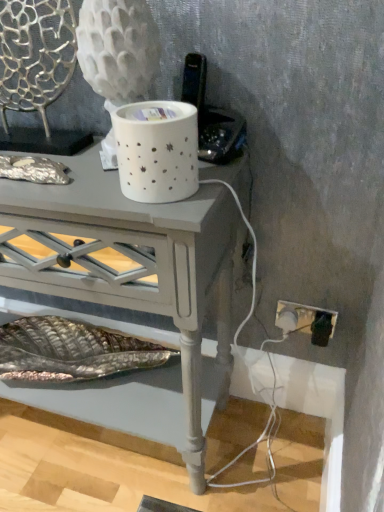
Identify the location of metallic silver swivel chair at upper left. (35, 54).

This screenshot has height=512, width=384. What do you see at coordinates (35, 54) in the screenshot?
I see `metallic silver swivel chair at upper left` at bounding box center [35, 54].

The height and width of the screenshot is (512, 384). Describe the element at coordinates (134, 261) in the screenshot. I see `matte gray table at center` at that location.

Locate an element on the screen. The height and width of the screenshot is (512, 384). matte gray table at center is located at coordinates (134, 261).

What is the approximate width of matte gray table at center?

The width of matte gray table at center is 12.21 inches.

Locate an element on the screen. The width and height of the screenshot is (384, 512). metallic silver swivel chair at upper left is located at coordinates (35, 54).

Looking at this image, considering the positions of objects matte gray table at center and metallic silver swivel chair at upper left in the image provided, who is more to the left, matte gray table at center or metallic silver swivel chair at upper left?

metallic silver swivel chair at upper left.

Is matte gray table at center further to the viewer compared to metallic silver swivel chair at upper left?

No, matte gray table at center is in front of metallic silver swivel chair at upper left.

Which is behind, point (66, 284) or point (44, 16)?

The point (66, 284) is behind.

From the image's perspective, would you say matte gray table at center is shown under metallic silver swivel chair at upper left?

Correct, matte gray table at center appears lower than metallic silver swivel chair at upper left in the image.

From a real-world perspective, is matte gray table at center on metallic silver swivel chair at upper left?

No, from a real-world perspective, matte gray table at center is not over metallic silver swivel chair at upper left

Which of these two, matte gray table at center or metallic silver swivel chair at upper left, is wider?

matte gray table at center.

From the picture: Considering the relative sizes of matte gray table at center and metallic silver swivel chair at upper left in the image provided, is matte gray table at center taller than metallic silver swivel chair at upper left?

Correct, matte gray table at center is much taller as metallic silver swivel chair at upper left.

Considering the sizes of objects matte gray table at center and metallic silver swivel chair at upper left in the image provided, who is bigger, matte gray table at center or metallic silver swivel chair at upper left?

Bigger between the two is matte gray table at center.

Looking at this image, can metallic silver swivel chair at upper left be found inside matte gray table at center?

Definitely not — metallic silver swivel chair at upper left is not inside matte gray table at center.

Would you consider matte gray table at center to be distant from metallic silver swivel chair at upper left?

matte gray table at center is near metallic silver swivel chair at upper left, not far away.

Is matte gray table at center oriented away from metallic silver swivel chair at upper left?

No, metallic silver swivel chair at upper left is not at the back of matte gray table at center.

What's the angular difference between matte gray table at center and metallic silver swivel chair at upper left's facing directions?

The angle between the facing direction of matte gray table at center and the facing direction of metallic silver swivel chair at upper left is 7.88e-05 degrees.

How far apart are matte gray table at center and metallic silver swivel chair at upper left?

matte gray table at center is 14.69 inches away from metallic silver swivel chair at upper left.

I want to click on swivel chair behind the matte gray table at center, so click(x=35, y=54).

Would you say metallic silver swivel chair at upper left is to the left or to the right of matte gray table at center in the picture?

In the image, metallic silver swivel chair at upper left appears on the left side of matte gray table at center.

Relative to matte gray table at center, is metallic silver swivel chair at upper left in front or behind?

metallic silver swivel chair at upper left is positioned farther from the viewer than matte gray table at center.

Does point (7, 39) come in front of point (215, 233)?

No, it is not.

From the image's perspective, is metallic silver swivel chair at upper left on matte gray table at center?

Correct, metallic silver swivel chair at upper left appears higher than matte gray table at center in the image.

From a real-world perspective, is metallic silver swivel chair at upper left physically above matte gray table at center?

Indeed, from a real-world perspective, metallic silver swivel chair at upper left stands above matte gray table at center.

Looking at their sizes, would you say metallic silver swivel chair at upper left is wider or thinner than matte gray table at center?

Considering their sizes, metallic silver swivel chair at upper left looks slimmer than matte gray table at center.

Who is taller, metallic silver swivel chair at upper left or matte gray table at center?

Standing taller between the two is matte gray table at center.

Between metallic silver swivel chair at upper left and matte gray table at center, which one has larger size?

Bigger between the two is matte gray table at center.

In the scene shown: Is metallic silver swivel chair at upper left outside of matte gray table at center?

Yes, metallic silver swivel chair at upper left is outside of matte gray table at center.

Does metallic silver swivel chair at upper left touch matte gray table at center?

No, metallic silver swivel chair at upper left is not next to matte gray table at center.

Is metallic silver swivel chair at upper left positioned with its back to matte gray table at center?

That's not correct — metallic silver swivel chair at upper left is not looking away from matte gray table at center.

How distant is metallic silver swivel chair at upper left from matte gray table at center?

They are 14.69 inches apart.

You are a GUI agent. You are given a task and a screenshot of the screen. Output one action in this format:
    pyautogui.click(x=<x>, y=<y>)
    Task: Click on the table below the metallic silver swivel chair at upper left (from the image's perspective)
    Image resolution: width=384 pixels, height=512 pixels.
    Given the screenshot: What is the action you would take?
    pyautogui.click(x=134, y=261)

Where is `swivel chair behind the matte gray table at center`? The image size is (384, 512). swivel chair behind the matte gray table at center is located at coordinates (35, 54).

The width and height of the screenshot is (384, 512). What are the coordinates of `table located below the metallic silver swivel chair at upper left (from the image's perspective)` in the screenshot? It's located at (134, 261).